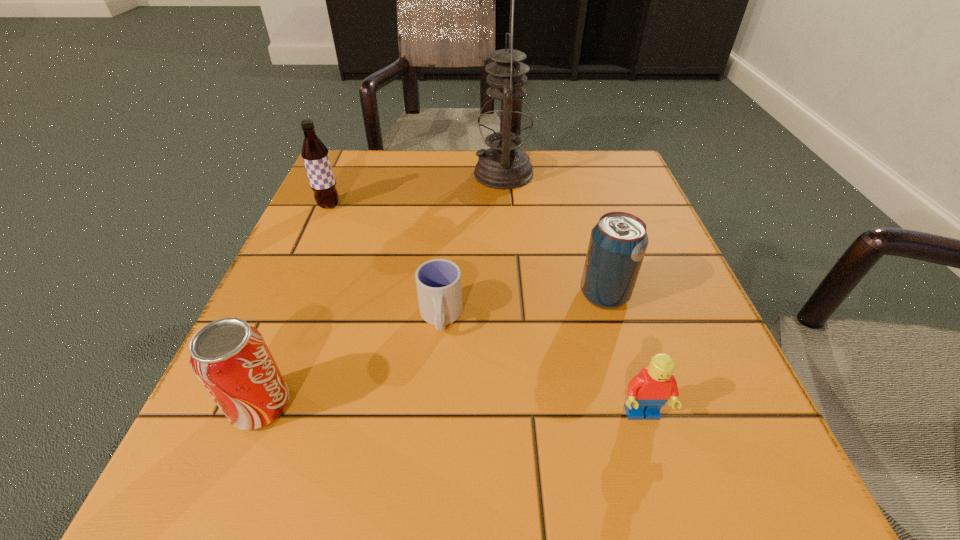
Locate an element on the screen. vacant space located on the right of the second farthest object is located at coordinates (445, 205).

Where is `blank area located on the right of the farther soda can`? The height and width of the screenshot is (540, 960). blank area located on the right of the farther soda can is located at coordinates (696, 295).

Find the location of a particular element. Image resolution: width=960 pixels, height=540 pixels. vacant space located on the right of the nearer soda can is located at coordinates (434, 406).

Find the location of `free space located 0.080m on the face of the Lego`. free space located 0.080m on the face of the Lego is located at coordinates (665, 494).

Where is `vacant area situated 0.080m with the handle on the side of the shortest object`? The height and width of the screenshot is (540, 960). vacant area situated 0.080m with the handle on the side of the shortest object is located at coordinates (435, 388).

What are the coordinates of `oil lamp that is at the far edge` in the screenshot? It's located at (505, 121).

In order to click on root beer located in the far edge section of the desktop in this screenshot , I will do (315, 155).

Image resolution: width=960 pixels, height=540 pixels. In order to click on root beer present at the left edge in this screenshot , I will do `click(315, 155)`.

Locate an element on the screen. The width and height of the screenshot is (960, 540). soda can that is at the left edge is located at coordinates (231, 358).

The width and height of the screenshot is (960, 540). Identify the location of pop soda that is at the right edge. (618, 242).